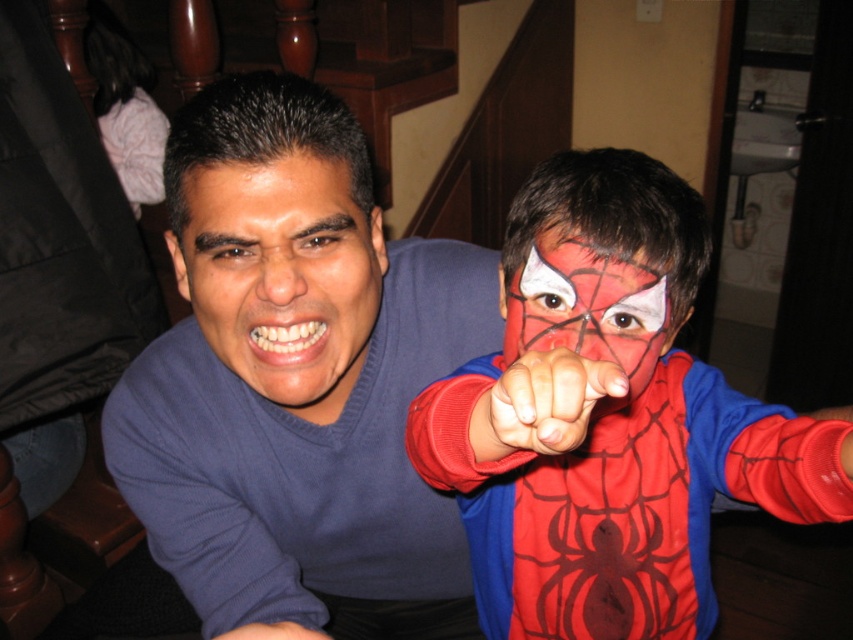
Who is positioned more to the left, blue cotton shirt at center or matte red face paint at center?

Positioned to the left is blue cotton shirt at center.

Is blue cotton shirt at center bigger than matte red face paint at center?

Indeed, blue cotton shirt at center has a larger size compared to matte red face paint at center.

Locate an element on the screen. blue cotton shirt at center is located at coordinates (294, 378).

Is point (344, 161) positioned after point (532, 264)?

Yes, point (344, 161) is farther from viewer.

Who is higher up, matte blue shirt at center or matte red face paint at center?

matte blue shirt at center is above.

Does point (293, 339) come behind point (596, 269)?

Yes.

You are a GUI agent. You are given a task and a screenshot of the screen. Output one action in this format:
    pyautogui.click(x=<x>, y=<y>)
    Task: Click on the matte blue shirt at center
    This screenshot has width=853, height=640.
    Given the screenshot: What is the action you would take?
    pyautogui.click(x=282, y=275)

Looking at this image, is matte red costume at center shorter than matte red face paint at center?

No.

Is matte red costume at center thinner than matte red face paint at center?

Incorrect, matte red costume at center's width is not less than matte red face paint at center's.

Who is more distant from viewer, (537, 196) or (653, 348)?

The point (653, 348) is behind.

Identify the location of matte red costume at center. (608, 419).